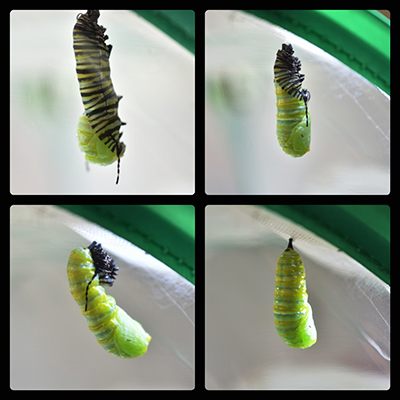
Locate an element on the screen. The height and width of the screenshot is (400, 400). black divider is located at coordinates (201, 45), (200, 256), (160, 200), (279, 199).